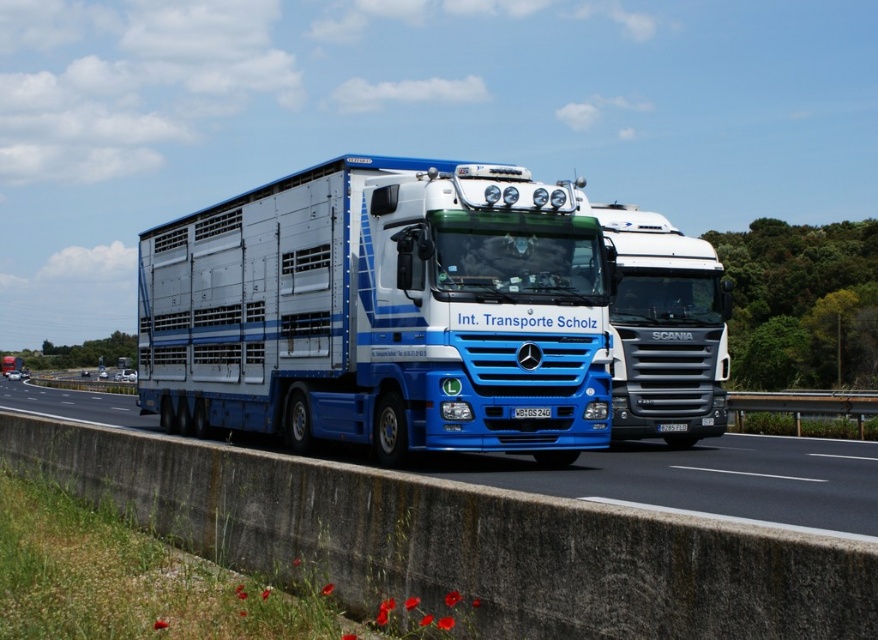
Question: Based on their relative distances, which object is farther from the white glossy truck at center?

Choices:
 (A) blue glossy truck at center
 (B) blue plastic license plate at center
 (C) white plastic license plate at center

Answer: (A)

Question: Is blue glossy truck at center thinner than white plastic license plate at center?

Choices:
 (A) no
 (B) yes

Answer: (A)

Question: Is the position of blue glossy truck at center more distant than that of white glossy truck at center?

Choices:
 (A) no
 (B) yes

Answer: (A)

Question: Which object appears closest to the camera in this image?

Choices:
 (A) blue plastic license plate at center
 (B) blue glossy trailer truck at center

Answer: (B)

Question: Which point is farther to the camera?

Choices:
 (A) blue glossy trailer truck at center
 (B) blue plastic license plate at center
 (C) white glossy truck at center

Answer: (C)

Question: Can you confirm if blue glossy trailer truck at center is positioned above white glossy truck at center?

Choices:
 (A) no
 (B) yes

Answer: (A)